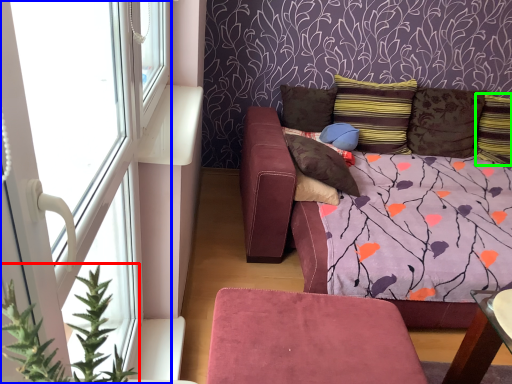
Question: Which object is the farthest from plant (highlighted by a red box)? Choose among these: window (highlighted by a blue box) or pillow (highlighted by a green box).

Choices:
 (A) window
 (B) pillow

Answer: (B)